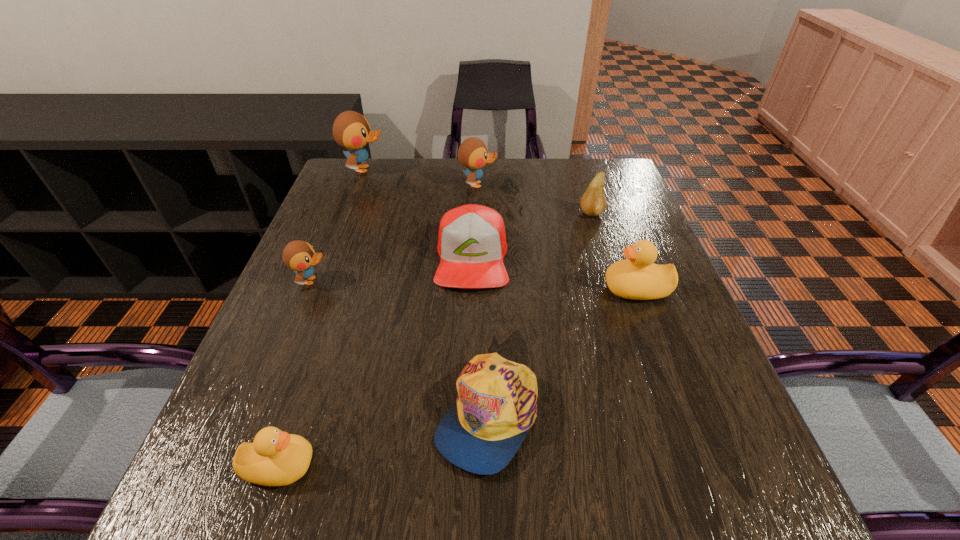
Where is `vacant region located on the face of the smaller yellow duck`? Image resolution: width=960 pixels, height=540 pixels. vacant region located on the face of the smaller yellow duck is located at coordinates (352, 466).

At what (x,y) coordinates should I click in order to perform the action: click on duck that is at the near edge. Please return your answer as a coordinate pair (x, y). The width and height of the screenshot is (960, 540). Looking at the image, I should click on (275, 458).

Find the location of a particular element. The width and height of the screenshot is (960, 540). cap at the near edge is located at coordinates (496, 405).

The width and height of the screenshot is (960, 540). I want to click on duck that is at the right edge, so click(637, 277).

Find the location of a particular element. The height and width of the screenshot is (540, 960). pear that is at the right edge is located at coordinates (593, 202).

The image size is (960, 540). Identify the location of object that is at the far left corner. (351, 130).

This screenshot has width=960, height=540. Identify the location of object that is at the near left corner. (275, 458).

Identify the location of free spot at the far edge of the desktop. The height and width of the screenshot is (540, 960). (523, 160).

This screenshot has width=960, height=540. In order to click on vacant space at the near edge of the desktop in this screenshot , I will do `click(511, 515)`.

This screenshot has width=960, height=540. In the image, there is a desktop. In order to click on vacant space at the left edge in this screenshot , I will do `click(337, 224)`.